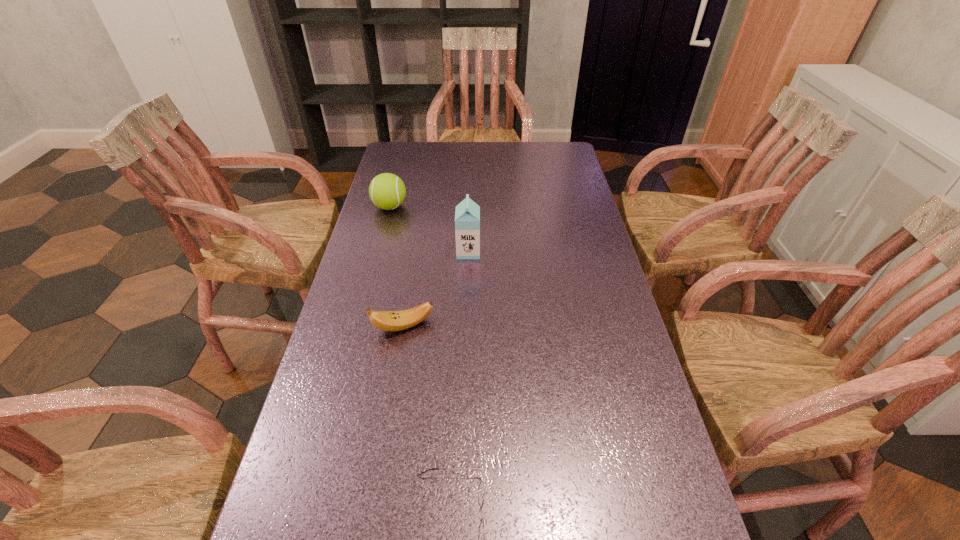
You are a GUI agent. You are given a task and a screenshot of the screen. Output one action in this format:
    pyautogui.click(x=<x>, y=<y>)
    Task: Click on the banana present at the left edge
    
    Given the screenshot: What is the action you would take?
    pyautogui.click(x=384, y=320)

Where is `vacant position at the far edge of the desktop`? vacant position at the far edge of the desktop is located at coordinates (522, 145).

This screenshot has height=540, width=960. Find the location of `blank space at the left edge of the desktop`. blank space at the left edge of the desktop is located at coordinates (335, 484).

At what (x,y) coordinates should I click in order to perform the action: click on free space at the right edge of the desktop. Please return your answer as a coordinate pair (x, y). Image resolution: width=960 pixels, height=540 pixels. Looking at the image, I should click on (617, 395).

The image size is (960, 540). In the image, there is a desktop. Find the location of `free region at the far right corner`. free region at the far right corner is located at coordinates (540, 167).

Locate an element on the screen. This screenshot has height=540, width=960. vacant point located between the milk carton and the third shortest object is located at coordinates (429, 229).

Identify the location of free space between the second nearest object and the tallest object. The width and height of the screenshot is (960, 540). (436, 289).

The height and width of the screenshot is (540, 960). Identify the location of free space that is in between the milk carton and the third tallest object. (436, 289).

Locate an element on the screen. The image size is (960, 540). free spot between the milk carton and the banana is located at coordinates (436, 289).

The image size is (960, 540). Find the location of `vacant region between the second farthest object and the farthest object`. vacant region between the second farthest object and the farthest object is located at coordinates (429, 229).